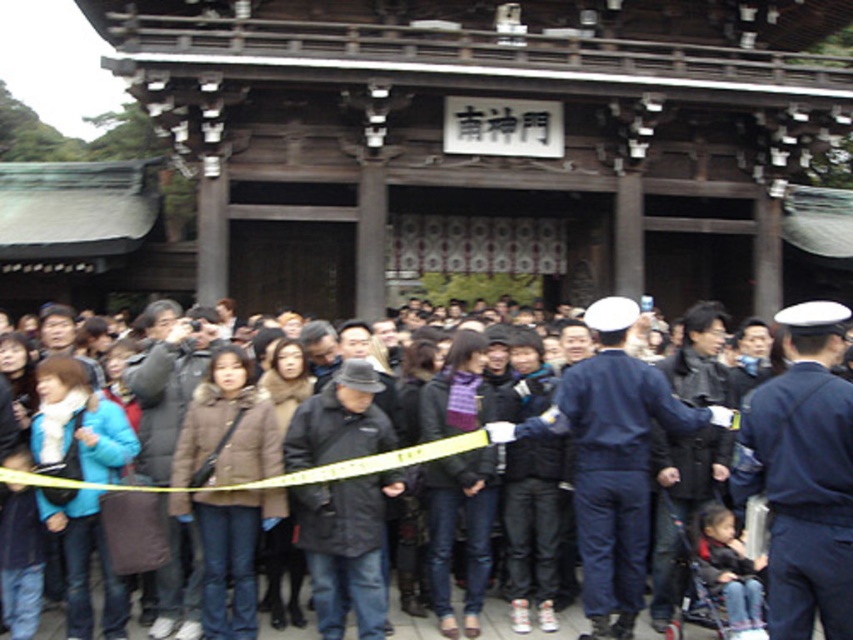
Who is taller, blue uniform at center or dark blue uniform at center?

dark blue uniform at center

Identify the location of blue uniform at center. The width and height of the screenshot is (853, 640). [x=804, y=474].

Is point (793, 577) in front of point (614, 588)?

Yes.

At what (x,y) coordinates should I click in order to perform the action: click on blue uniform at center. Please return your answer as a coordinate pair (x, y). Looking at the image, I should click on (804, 474).

Between point (590, 496) and point (462, 444), which one is positioned in front?

Point (590, 496)

Who is positioned more to the left, dark blue uniform at center or dark gray coat at center?

From the viewer's perspective, dark blue uniform at center appears more on the left side.

Where is `dark blue uniform at center`? dark blue uniform at center is located at coordinates (611, 460).

Between blue uniform at center and dark gray coat at center, which one appears on the left side from the viewer's perspective?

dark gray coat at center is more to the left.

Which is behind, point (830, 586) or point (827, 320)?

The point (827, 320) is more distant.

What do you see at coordinates (804, 474) in the screenshot? I see `blue uniform at center` at bounding box center [804, 474].

At what (x,y) coordinates should I click in order to perform the action: click on blue uniform at center. Please return your answer as a coordinate pair (x, y). Looking at the image, I should click on (804, 474).